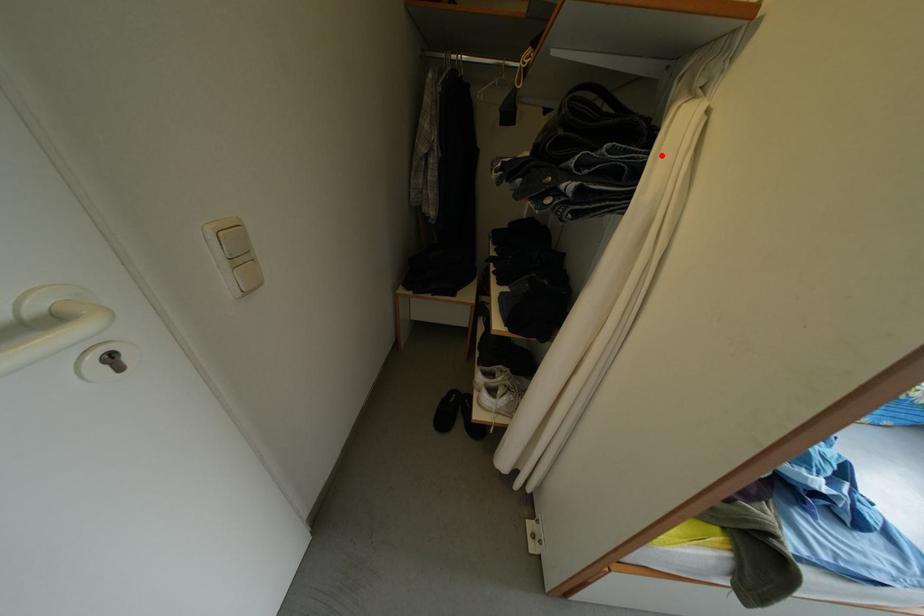
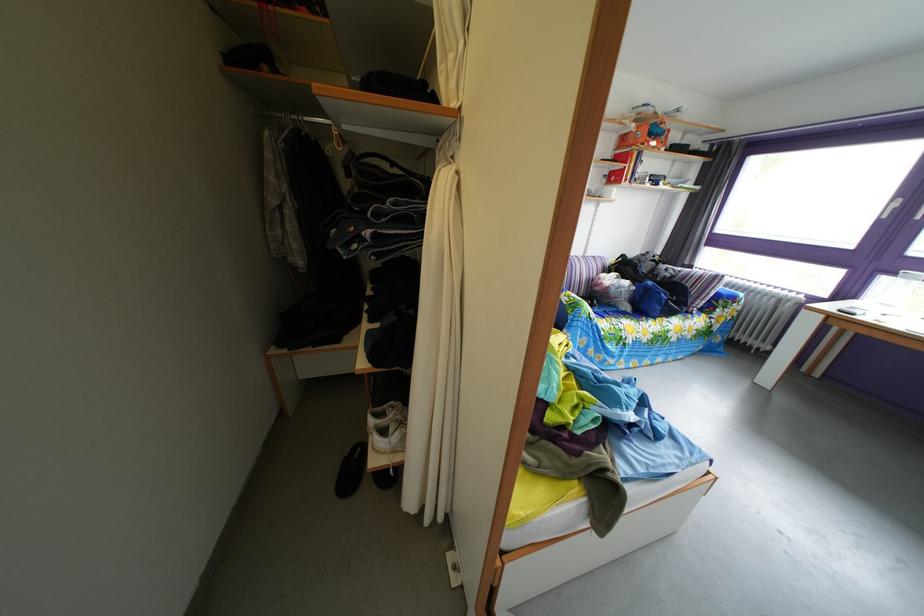
In the second image, find the point that corresponds to the highlighted location in the first image.

(438, 207)